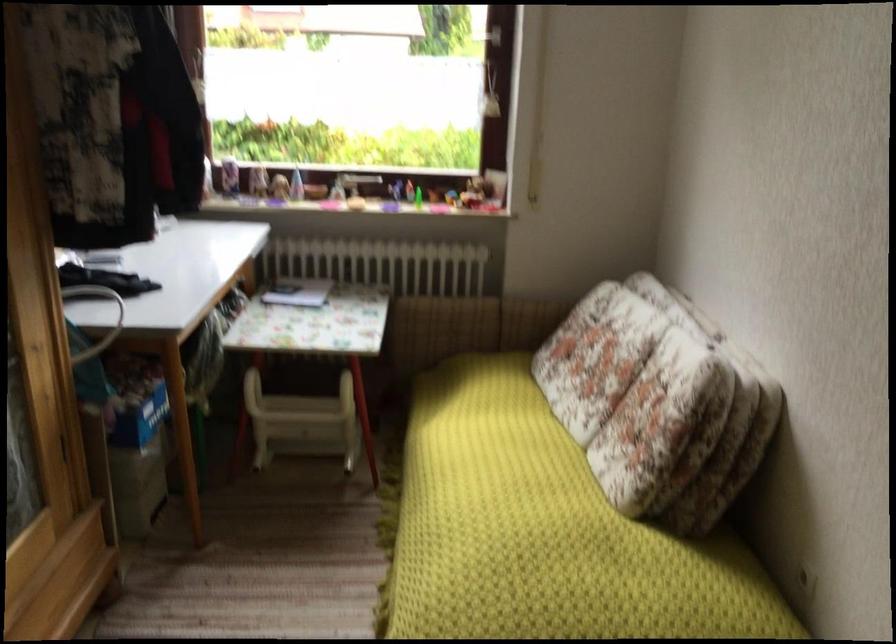
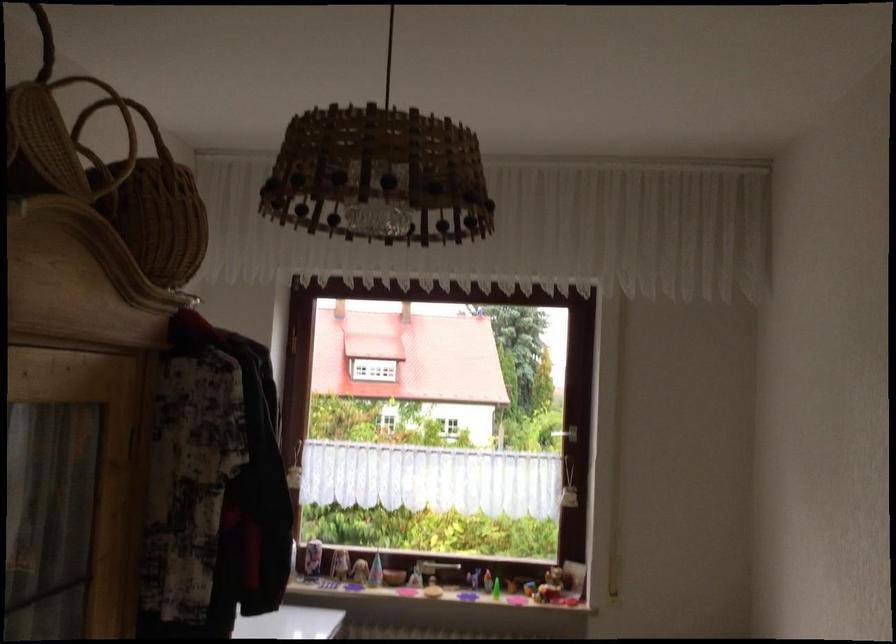
Question: The images are taken continuously from a first-person perspective. In which direction are you moving?

Choices:
 (A) Left
 (B) Right
 (C) Forward
 (D) Backward

Answer: (D)